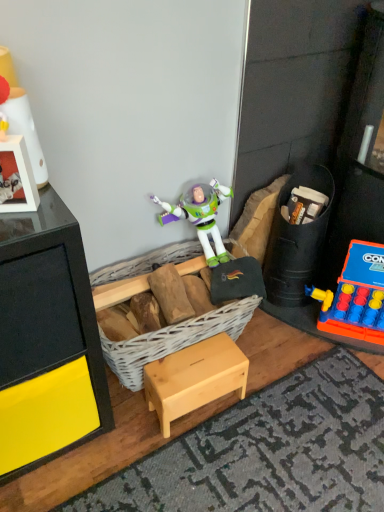
In order to click on vacant region above natural wood stool at center (from a real-world perspective) in this screenshot , I will do `click(194, 360)`.